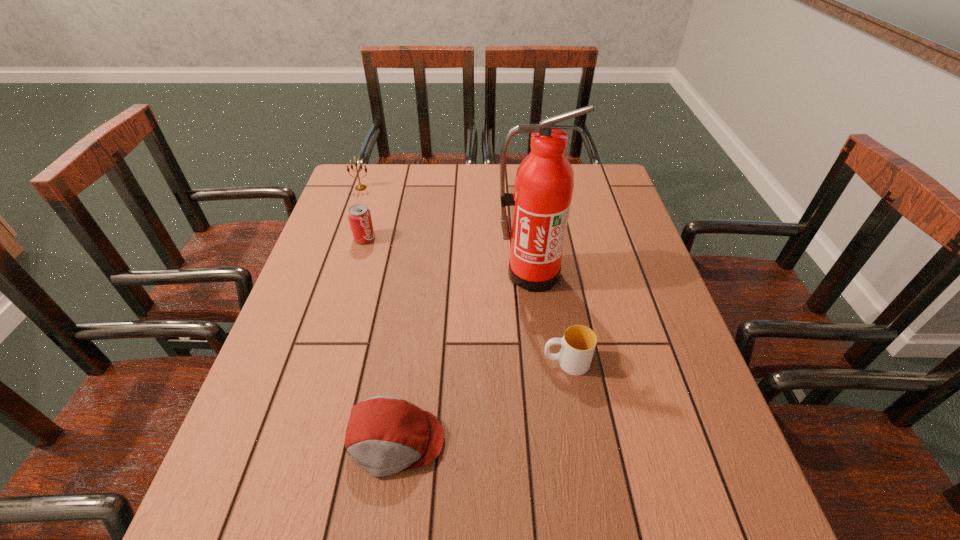
Find the location of a particular element. The height and width of the screenshot is (540, 960). the tallest object is located at coordinates (544, 182).

The image size is (960, 540). I want to click on fire extinguisher, so click(544, 182).

Locate an element on the screen. the farthest object is located at coordinates (360, 187).

Where is `the second farthest object`? the second farthest object is located at coordinates (359, 216).

This screenshot has width=960, height=540. What are the coordinates of `cup` in the screenshot? It's located at (578, 344).

The height and width of the screenshot is (540, 960). Find the location of `the nearest object`. the nearest object is located at coordinates (385, 435).

Where is `the third object from right to left`? Image resolution: width=960 pixels, height=540 pixels. the third object from right to left is located at coordinates (385, 435).

This screenshot has height=540, width=960. Identify the location of vacant position located on the label side of the third farthest object. pos(536,316).

Identify the location of free space located on the front of the candelabrum. (340, 248).

The width and height of the screenshot is (960, 540). What are the coordinates of `vacant point located on the right of the soda can` in the screenshot? It's located at (515, 238).